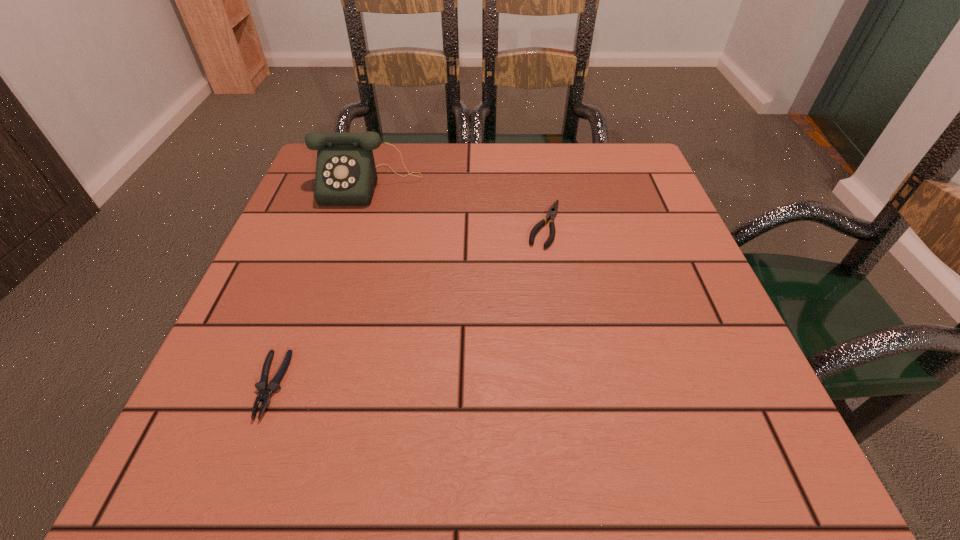
The width and height of the screenshot is (960, 540). Identify the location of telephone that is at the left edge. (346, 175).

This screenshot has width=960, height=540. What are the coordinates of `pliers that is positioned at the left edge` in the screenshot? It's located at (265, 390).

Where is `object positioned at the far left corner`? This screenshot has width=960, height=540. object positioned at the far left corner is located at coordinates [x=346, y=175].

Identify the location of object at the near left corner. This screenshot has height=540, width=960. (265, 390).

Locate an element on the screen. The image size is (960, 540). vacant space at the far edge is located at coordinates (509, 147).

You are a GUI agent. You are given a task and a screenshot of the screen. Output one action in this format:
    pyautogui.click(x=<x>, y=<y>)
    Task: Click on the vacant space at the near edge of the desktop
    
    Given the screenshot: What is the action you would take?
    pyautogui.click(x=468, y=435)

Identify the location of free region at the left edge of the desktop. The width and height of the screenshot is (960, 540). (228, 348).

I want to click on free space at the right edge of the desktop, so (x=604, y=239).

Image resolution: width=960 pixels, height=540 pixels. I want to click on free space at the far left corner of the desktop, so click(x=310, y=171).

Where is `vacant space at the near left corner of the desktop`? vacant space at the near left corner of the desktop is located at coordinates (197, 424).